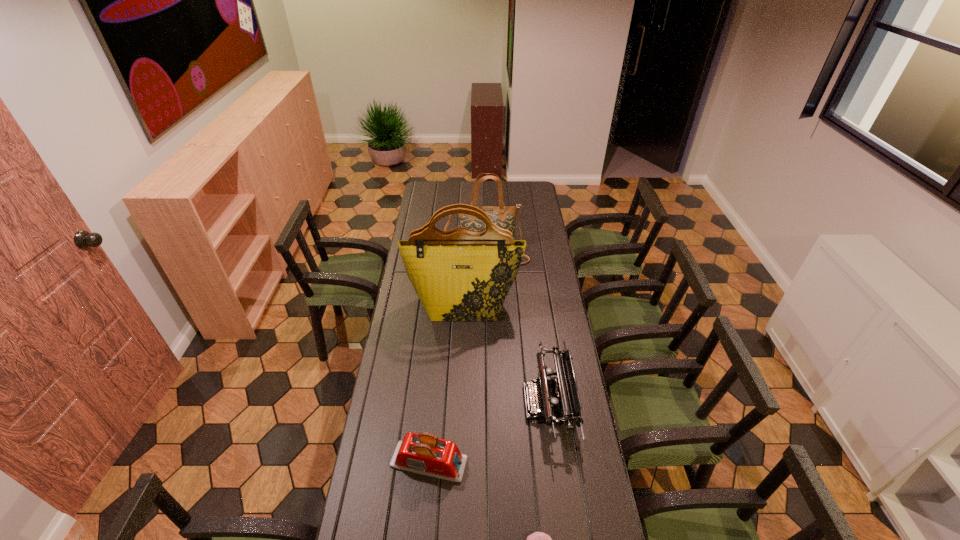
Image resolution: width=960 pixels, height=540 pixels. What are the coordinates of `vacant region between the fourth nearest object and the typewriter` in the screenshot? It's located at (506, 354).

Where is `free point between the handbag and the toaster`? Image resolution: width=960 pixels, height=540 pixels. free point between the handbag and the toaster is located at coordinates (458, 357).

This screenshot has width=960, height=540. Find the location of `vacant space in between the toaster and the typewriter`. vacant space in between the toaster and the typewriter is located at coordinates (489, 432).

What are the coordinates of `object that is the fourth closest to the typewriter` in the screenshot? It's located at (503, 216).

Locate an element on the screen. The height and width of the screenshot is (540, 960). object that ranks as the third closest to the typewriter is located at coordinates (538, 539).